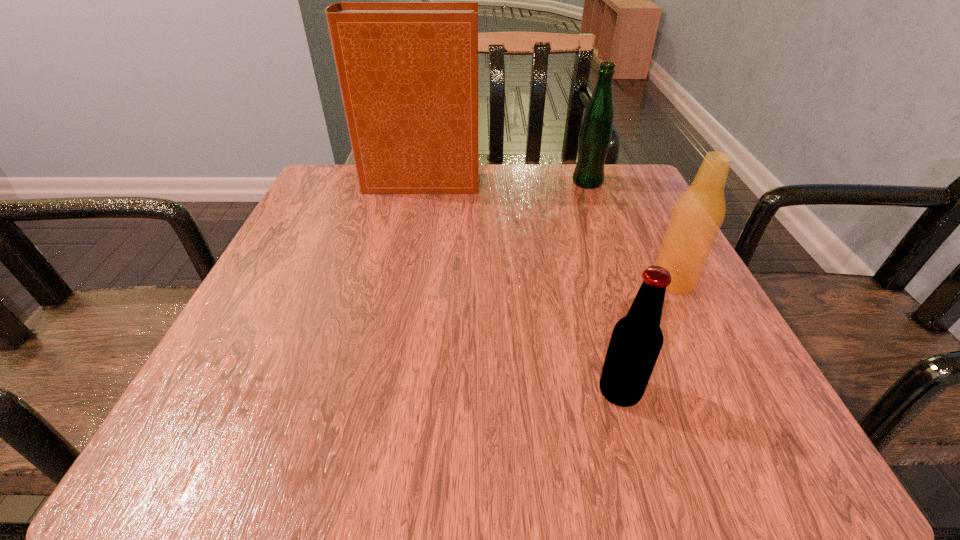
Identify the location of vacant area between the farthest beer bottle and the hardback book. This screenshot has width=960, height=540. (503, 183).

What are the coordinates of `object that is the closest to the farthest beer bottle` in the screenshot? It's located at (408, 71).

Choose which object is the third nearest neighbor to the rightmost beer bottle. Please provide its 2D coordinates. Your answer should be formatted as a tuple, i.e. [(x, y)], where the tuple contains the x and y coordinates of a point satisfying the conditions above.

[(408, 71)]

Image resolution: width=960 pixels, height=540 pixels. What are the coordinates of `beer bottle that is the second closest to the nearest object` in the screenshot? It's located at (595, 136).

Identify which beer bottle is the second closest to the tallest object. Please provide its 2D coordinates. Your answer should be formatted as a tuple, i.e. [(x, y)], where the tuple contains the x and y coordinates of a point satisfying the conditions above.

[(696, 218)]

Find the location of a particular element. This screenshot has height=540, width=960. free spot that satisfies the following two spatial constraints: 1. on the open cover of the second farthest beer bottle; 2. on the right side of the hardback book is located at coordinates (399, 281).

Find the location of `free space that satisfies the following two spatial constraints: 1. on the open cover of the tallest object; 2. on the right side of the rightmost object`. free space that satisfies the following two spatial constraints: 1. on the open cover of the tallest object; 2. on the right side of the rightmost object is located at coordinates (399, 281).

Image resolution: width=960 pixels, height=540 pixels. What are the coordinates of `vacant area that satisfies the following two spatial constraints: 1. on the open cover of the hardback book; 2. on the back side of the nearest beer bottle` in the screenshot? It's located at (376, 392).

The image size is (960, 540). In order to click on vacant position in the image that satisfies the following two spatial constraints: 1. on the open cover of the tallest object; 2. on the back side of the second farthest beer bottle in this screenshot , I will do `click(399, 281)`.

At what (x,y) coordinates should I click in order to perform the action: click on free location that satisfies the following two spatial constraints: 1. on the back side of the rightmost beer bottle; 2. on the open cover of the tallest object. Please return your answer as a coordinate pair (x, y). The width and height of the screenshot is (960, 540). Looking at the image, I should click on (624, 183).